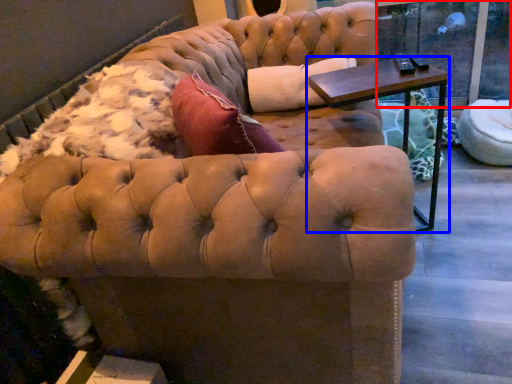
Question: Which object appears farthest to the camera in this image, window screen (highlighted by a red box) or table (highlighted by a blue box)?

Choices:
 (A) window screen
 (B) table

Answer: (A)